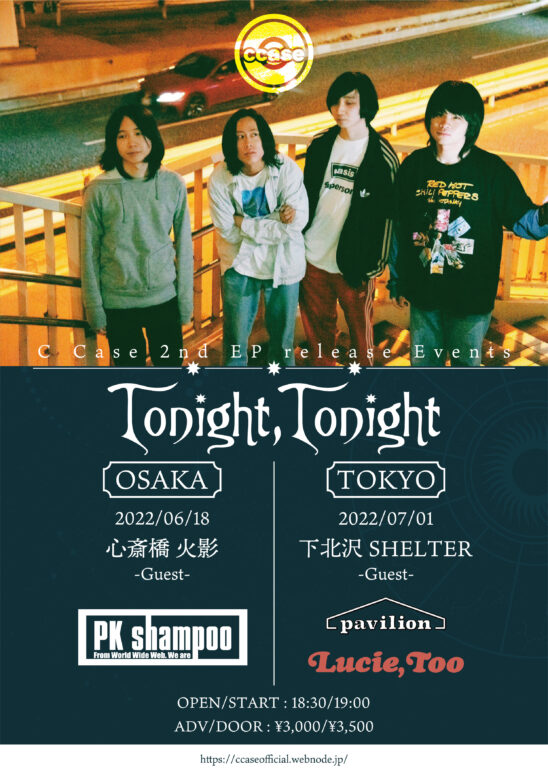
The height and width of the screenshot is (775, 548). In order to click on door in this screenshot , I will do `click(238, 722)`.